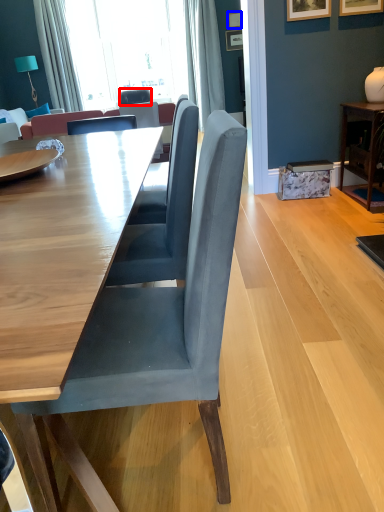
Question: Among these objects, which one is nearest to the camera, chair (highlighted by a red box) or picture frame (highlighted by a blue box)?

Choices:
 (A) chair
 (B) picture frame

Answer: (B)